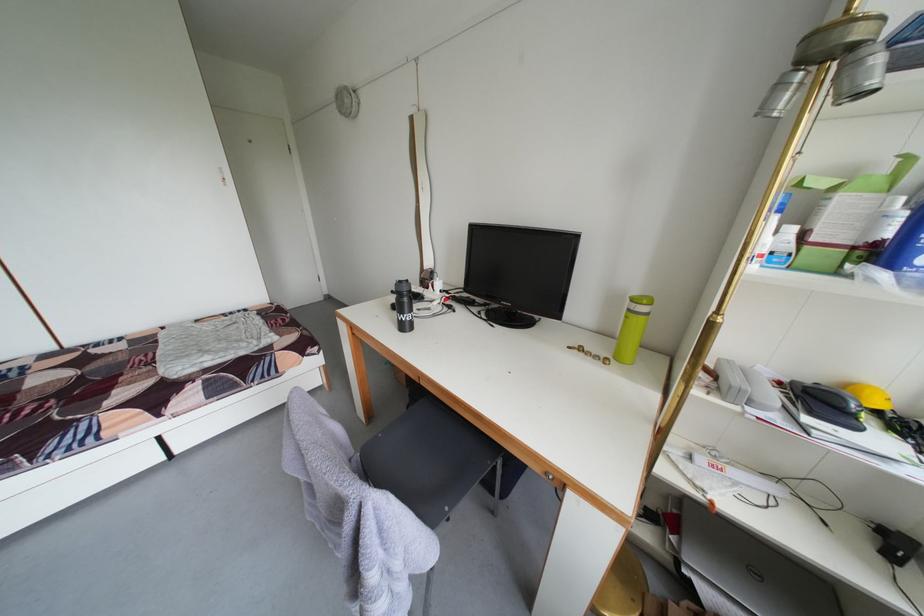
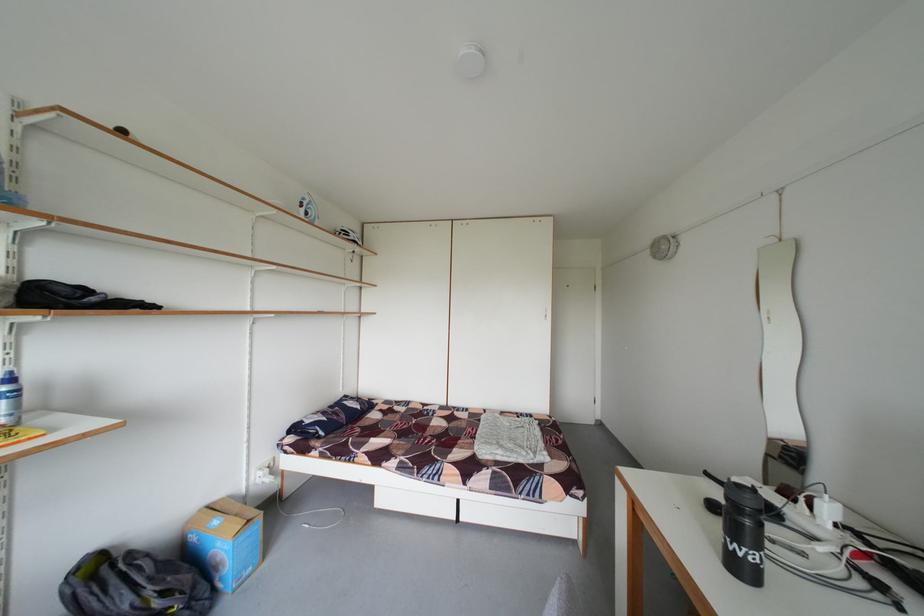
Find the pixel in the second image that matches [415,294] in the first image.

(759, 507)